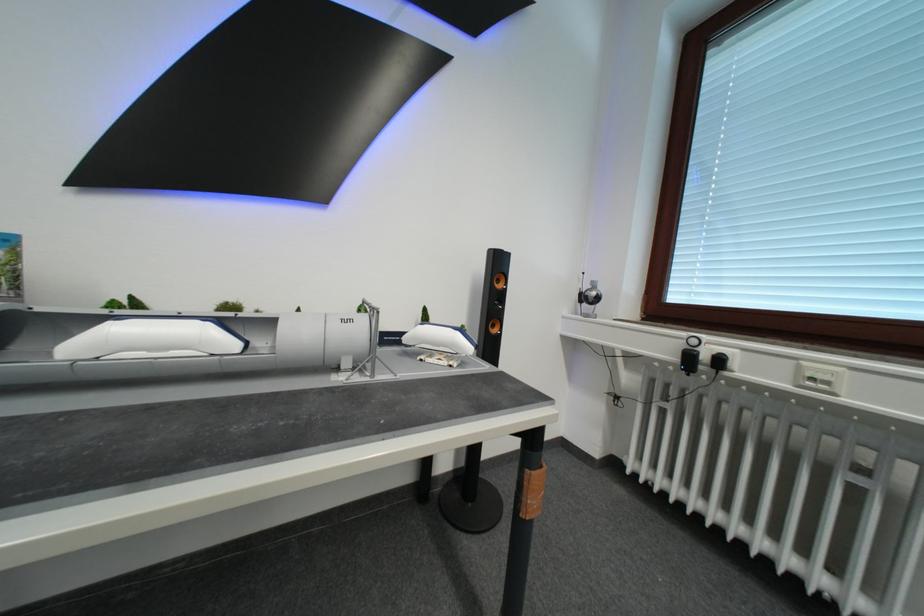
Find where to pull the black wall adapter. Please return your answer as a coordinate pair (x, y).

(589, 298)